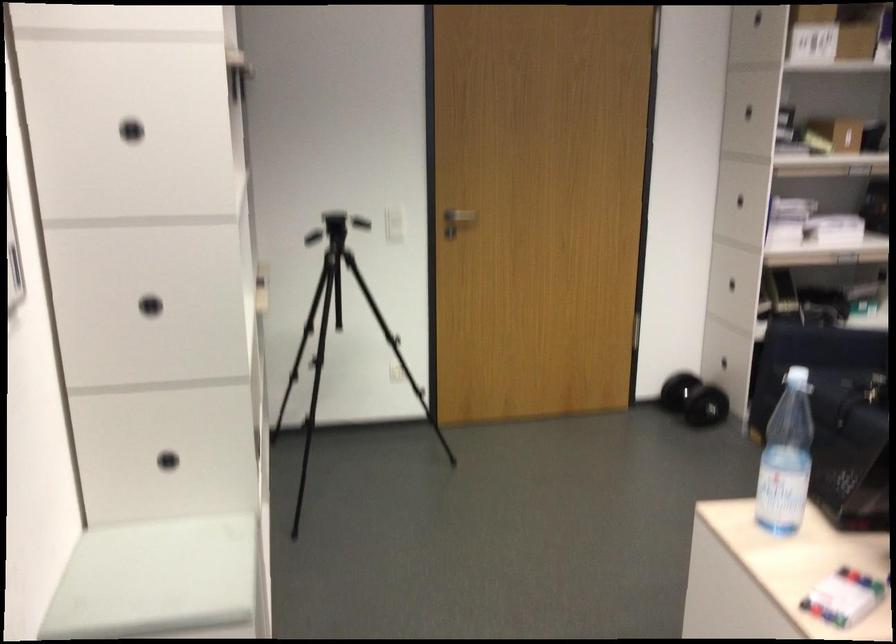
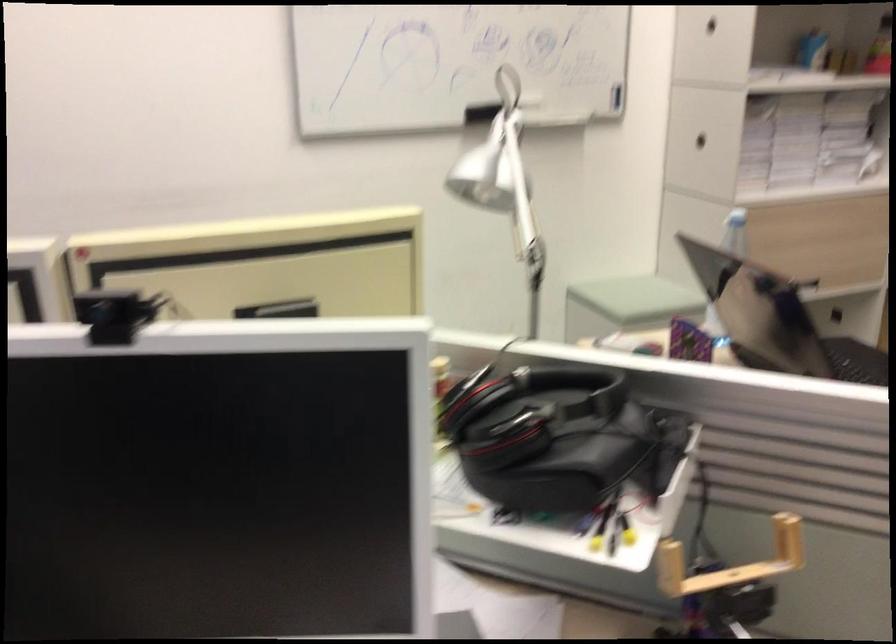
Locate, in the second image, the point that corresponds to [152,429] in the first image.

(735, 232)